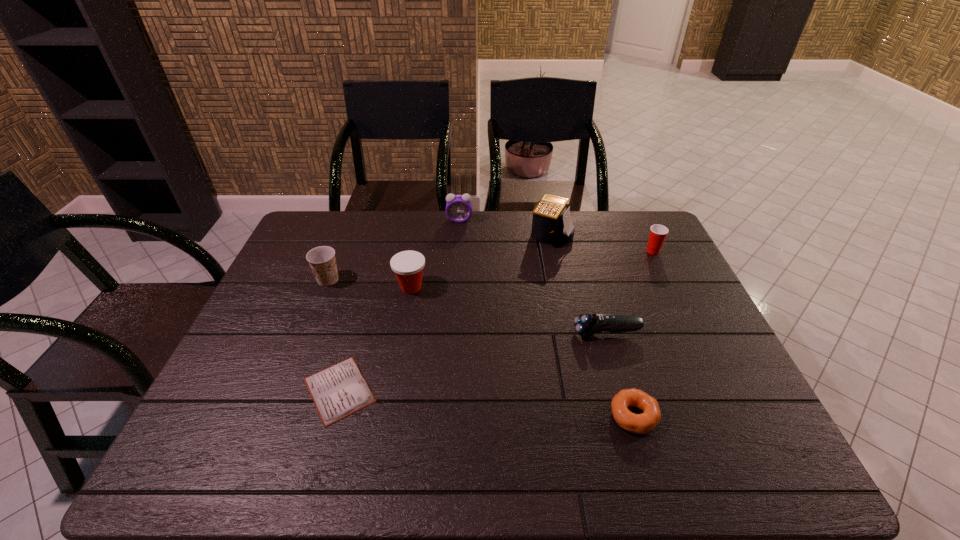
Locate an element on the screen. This screenshot has height=540, width=960. vacant area that lies between the doughnut and the shortest object is located at coordinates (487, 403).

Find the location of a particular element. free area in between the calculator and the second Dixie cup from right to left is located at coordinates (481, 261).

At what (x,y) coordinates should I click in order to perform the action: click on unoccupied position between the calculator and the electric shaver. Please return your answer as a coordinate pair (x, y). The height and width of the screenshot is (540, 960). Looking at the image, I should click on (579, 284).

Identify the location of object that is the closest to the second shortest object. This screenshot has height=540, width=960. (587, 325).

Select which object appears as the fifth closest to the doughnut. Please provide its 2D coordinates. Your answer should be formatted as a tuple, i.e. [(x, y)], where the tuple contains the x and y coordinates of a point satisfying the conditions above.

[(551, 224)]

Select which Dixie cup is the closest to the alarm clock. Please provide its 2D coordinates. Your answer should be formatted as a tuple, i.e. [(x, y)], where the tuple contains the x and y coordinates of a point satisfying the conditions above.

[(408, 266)]

Locate which Dixie cup ranks in proximity to the fourth object from left to right. Please provide its 2D coordinates. Your answer should be formatted as a tuple, i.e. [(x, y)], where the tuple contains the x and y coordinates of a point satisfying the conditions above.

[(408, 266)]

Locate an element on the screen. This screenshot has height=540, width=960. free space that satisfies the following two spatial constraints: 1. on the face of the seventh tallest object; 2. on the left side of the alarm clock is located at coordinates (447, 416).

Find the location of `free space that satisfies the following two spatial constraints: 1. on the face of the alarm clock; 2. on the right side of the doughnut`. free space that satisfies the following two spatial constraints: 1. on the face of the alarm clock; 2. on the right side of the doughnut is located at coordinates (447, 416).

What are the coordinates of `free space that satisfies the following two spatial constraints: 1. on the face of the rightmost Dixie cup; 2. on the right side of the fifth object from right to left` in the screenshot? It's located at (457, 251).